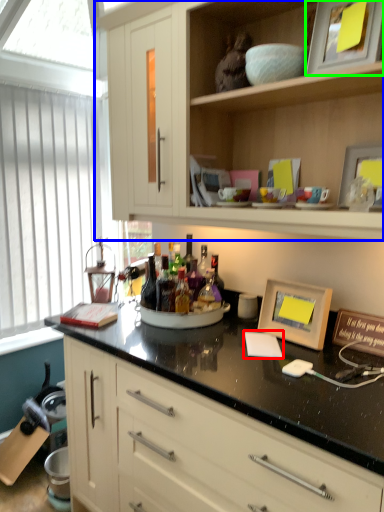
Question: Based on their relative distances, which object is farther from notepad (highlighted by a red box)? Choose from cabinetry (highlighted by a blue box) and picture frame (highlighted by a green box).

Choices:
 (A) cabinetry
 (B) picture frame

Answer: (B)